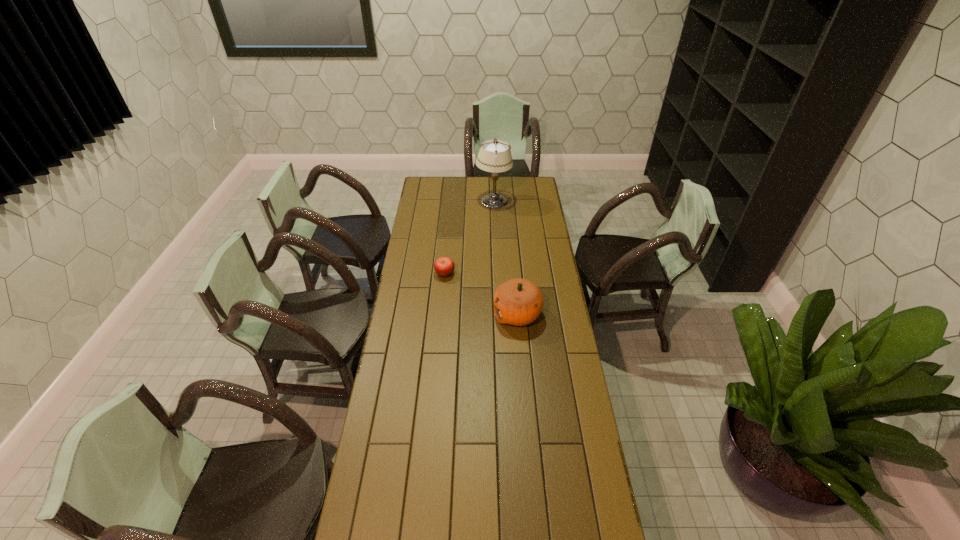
Locate which object ranks in proximity to the second tallest object. Please provide its 2D coordinates. Your answer should be formatted as a tuple, i.e. [(x, y)], where the tuple contains the x and y coordinates of a point satisfying the conditions above.

[(444, 266)]

Identify which object is the second nearest to the leftmost object. Please provide its 2D coordinates. Your answer should be formatted as a tuple, i.e. [(x, y)], where the tuple contains the x and y coordinates of a point satisfying the conditions above.

[(494, 156)]